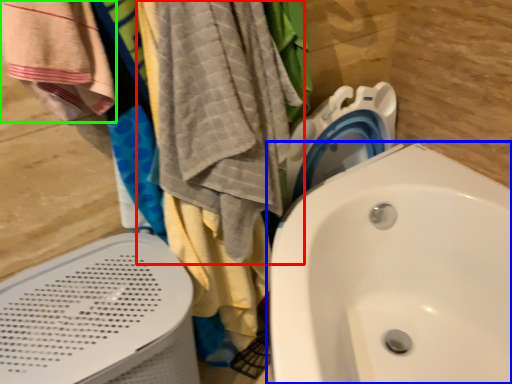
Question: Estimate the real-world distances between objects in this image. Which object is closer to beach towel (highlighted by a red box), sink (highlighted by a blue box) or beach towel (highlighted by a green box)?

Choices:
 (A) sink
 (B) beach towel

Answer: (B)